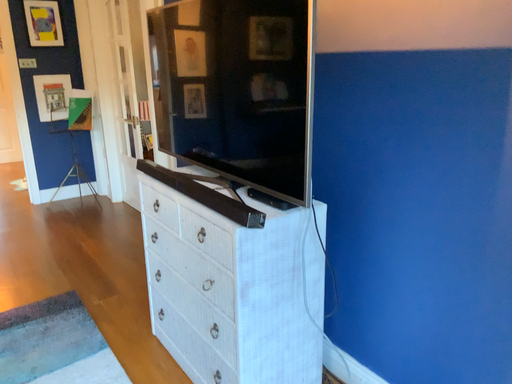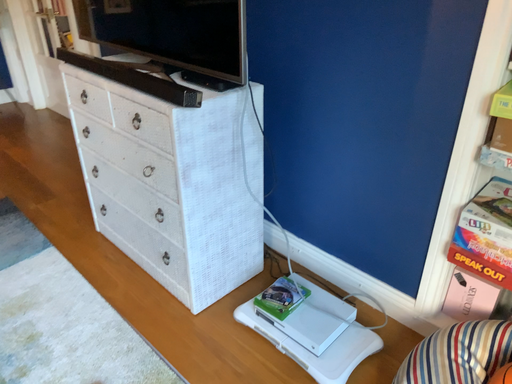
Question: Which way did the camera rotate in the video?

Choices:
 (A) rotated upward
 (B) rotated downward

Answer: (B)